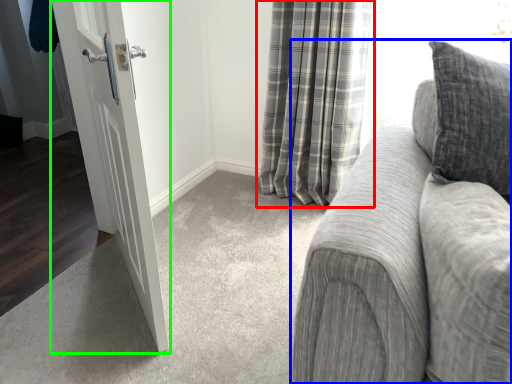
Question: Considering the real-world distances, which object is closest to curtain (highlighted by a red box)? studio couch (highlighted by a blue box) or door (highlighted by a green box).

Choices:
 (A) studio couch
 (B) door

Answer: (B)